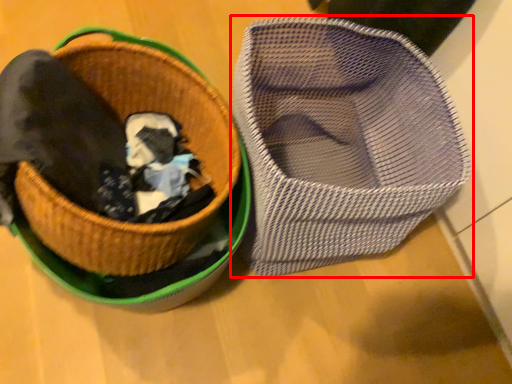
Question: From the image's perspective, what is the correct spatial positioning of footwear (annotated by the red box) in reference to basket?

Choices:
 (A) below
 (B) above

Answer: (A)